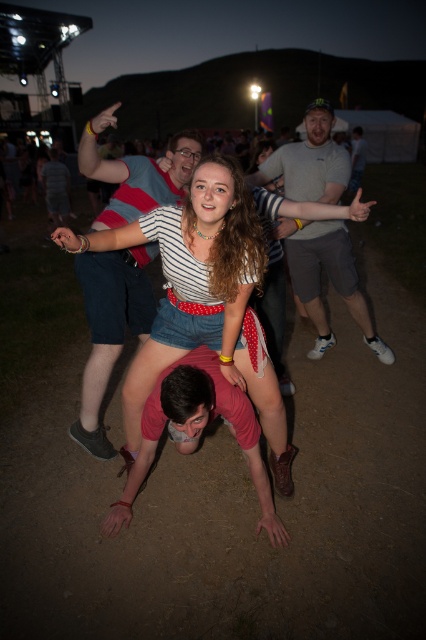
Is point (160, 193) positioned before point (336, 157)?

That is True.

Does striped t-shirt at center appear under gray fabric shirt at center?

Yes.

Is point (127, 304) behind point (291, 147)?

That is False.

The width and height of the screenshot is (426, 640). Find the location of `striped t-shirt at center`. striped t-shirt at center is located at coordinates (109, 326).

Consider the image. Which of these two, white striped shirt at center or striped t-shirt at center, stands shorter?

white striped shirt at center

Who is higher up, white striped shirt at center or striped t-shirt at center?

striped t-shirt at center is higher up.

Is point (155, 369) closer to camera compared to point (91, 442)?

Yes, it is in front of point (91, 442).

Where is `white striped shirt at center`? white striped shirt at center is located at coordinates (215, 244).

Consider the image. Does white striped shirt at center appear on the right side of gray fabric shirt at center?

In fact, white striped shirt at center is to the left of gray fabric shirt at center.

The image size is (426, 640). I want to click on white striped shirt at center, so click(215, 244).